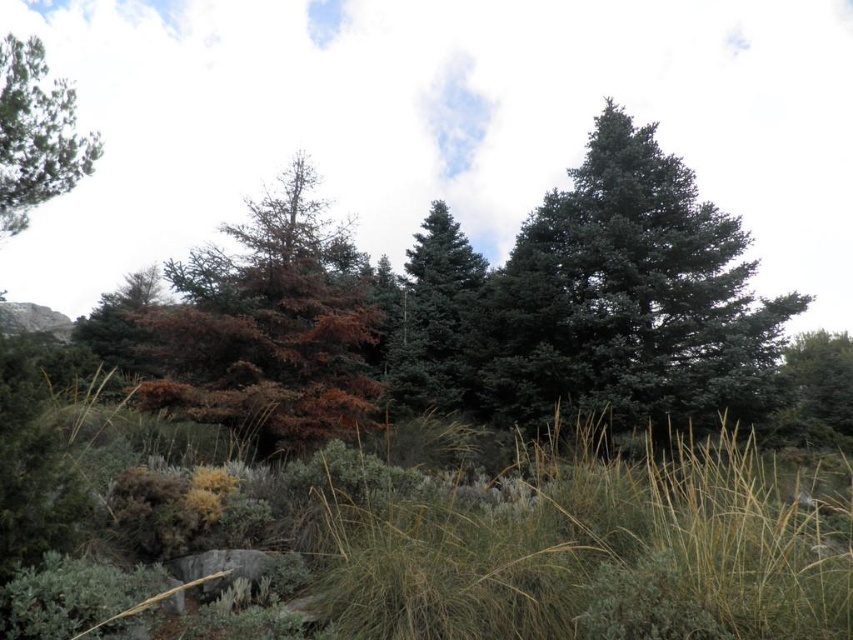
You are standing at the point marked as point (581, 544) in the image. What type of terrain are you currently standing on?

The point (581, 544) is on green fuzzy grass at center, so you are standing on green fuzzy grass.

You are a hiker trying to determine the best spot to set up your tent. You notice the dark green fir tree at center and the brown matte tree at left. Which tree would provide more shade given their sizes?

The dark green fir tree at center is much taller than the brown matte tree at left, so it would provide more shade.